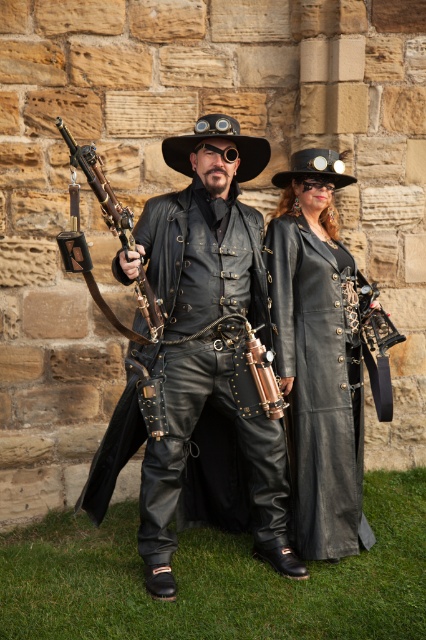
What is located at the coordinates point (x=207, y=339)?

The leather jacket at center is located at point (x=207, y=339).

You are a steampunk enthusiast examining the image. You notice the matte black coat at center and the polished brass rifle at center. Which object is located lower in the image?

The matte black coat at center is positioned under the polished brass rifle at center, so it is located lower in the image.